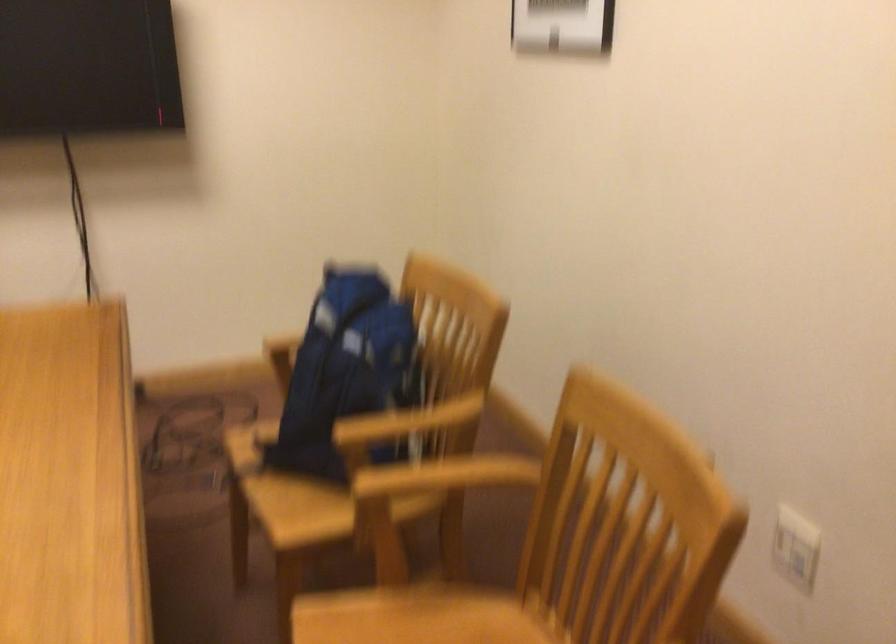
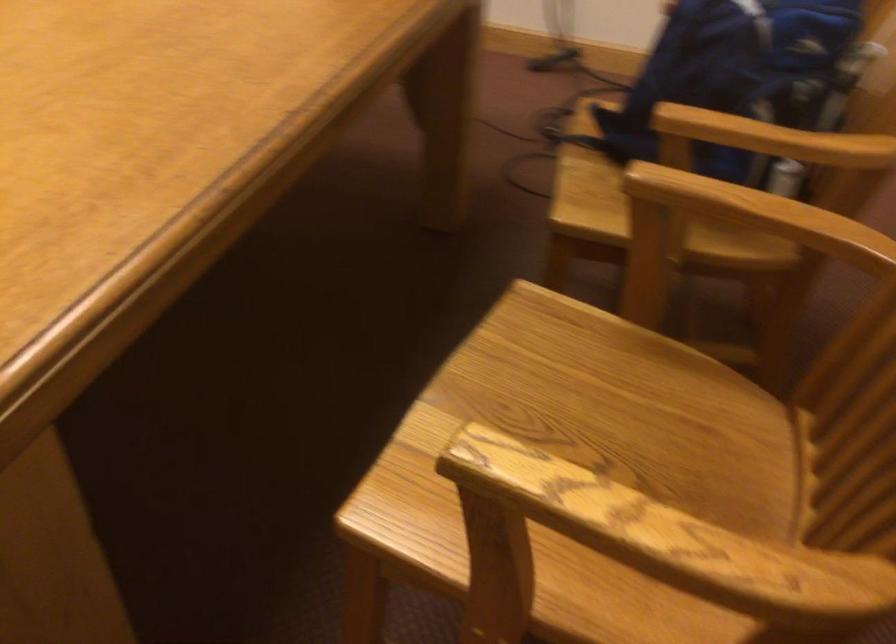
Where in the second image is the point corresponding to [438,488] from the first image?

(743, 223)